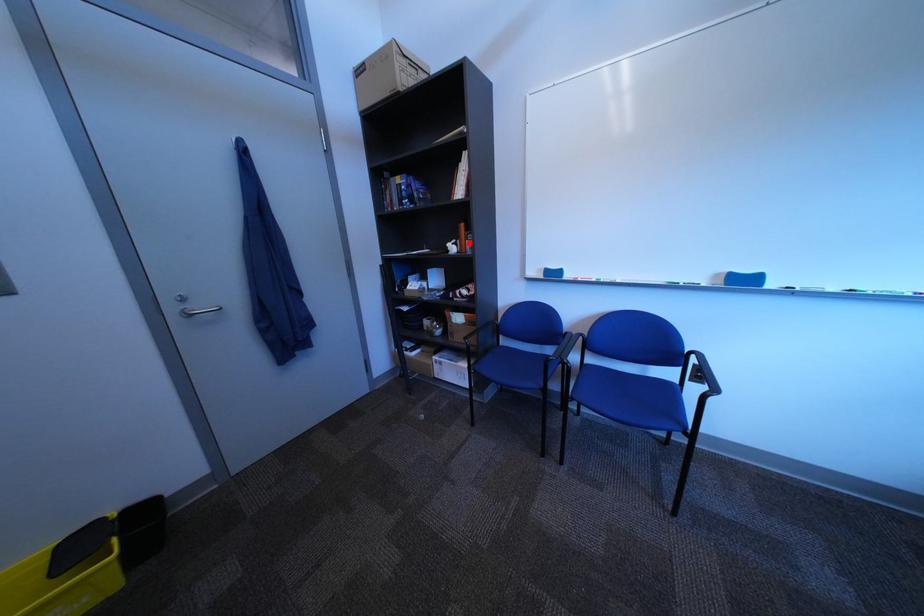
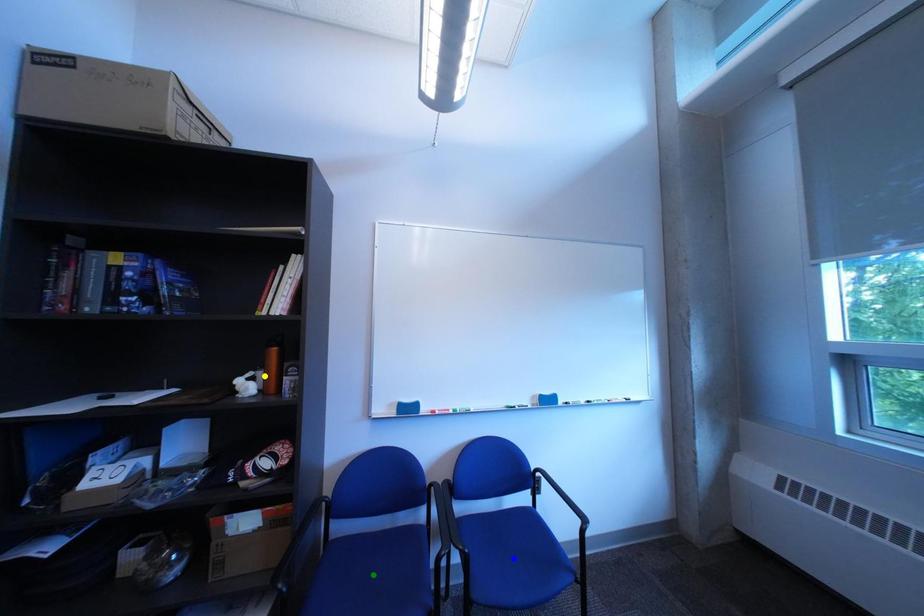
Question: I am providing you with two images of the same scene from different viewpoints. A red point is marked on the first image. You are given multiple points on the second image. Which spot in image 2 lines up with the point in image 1?

Choices:
 (A) green point
 (B) yellow point
 (C) blue point

Answer: (B)